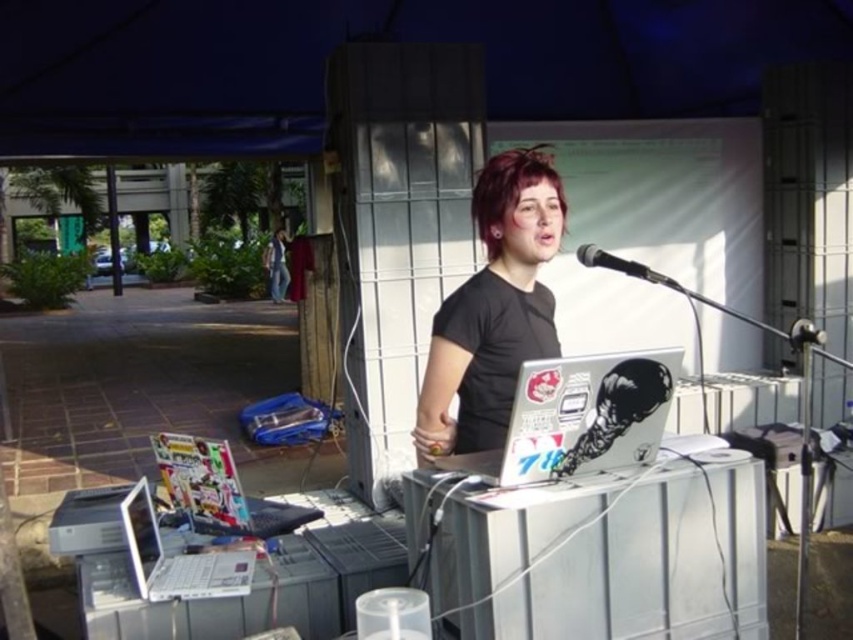
Can you confirm if black matte t-shirt at center is positioned to the left of black metallic microphone at upper right?

Correct, you'll find black matte t-shirt at center to the left of black metallic microphone at upper right.

Does point (519, 320) lie behind point (576, 253)?

No, it is in front of (576, 253).

Who is more forward, (x=532, y=296) or (x=682, y=291)?

Point (x=682, y=291) is more forward.

In order to click on black matte t-shirt at center in this screenshot , I will do `click(494, 307)`.

Who is lower down, black matte t-shirt at center or silver metallic laptop at lower left?

Positioned lower is silver metallic laptop at lower left.

Is black matte t-shirt at center shorter than silver metallic laptop at lower left?

No, black matte t-shirt at center is not shorter than silver metallic laptop at lower left.

Does point (505, 177) come farther from viewer compared to point (218, 579)?

No.

Locate an element on the screen. This screenshot has height=640, width=853. black matte t-shirt at center is located at coordinates (494, 307).

Which of these two, sticker-covered silver laptop at center or black metallic microphone at upper right, stands taller?

sticker-covered silver laptop at center

Who is more forward, (462, 458) or (602, 250)?

Point (462, 458)

This screenshot has height=640, width=853. In order to click on sticker-covered silver laptop at center in this screenshot , I will do `click(579, 417)`.